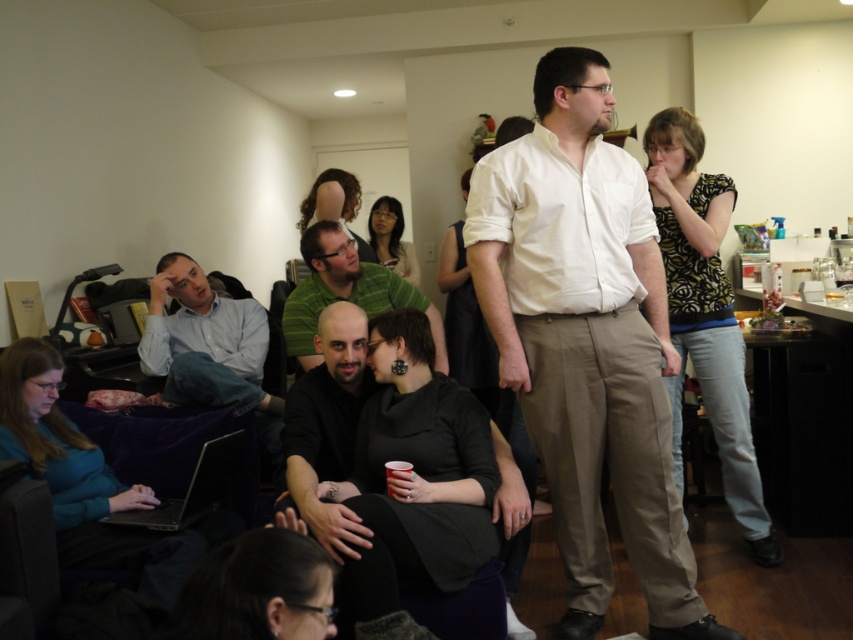
You are standing in the living room and want to place a new decorative item between the black glossy laptop at lower left and the white paper cup at lower center. Where should you position it to ensure it sits above the laptop but below the cup?

You should position the decorative item between the black glossy laptop at lower left and the white paper cup at lower center so that it is above the laptop but below the cup, as the laptop is already positioned below the cup.

You are standing in the living room and notice two shirts hanging on a rack. The matte blue shirt at left and the green matte shirt at center. Which shirt is positioned lower on the rack?

The matte blue shirt at left is below the green matte shirt at center, so it is positioned lower on the rack.

You are organizing a charity event and need to determine which of the two shirts, the matte blue shirt at left or the green matte shirt at center, would be more suitable for a large group photo where visibility is key. Based on their sizes, which one should you choose?

The matte blue shirt at left is larger in size than the green matte shirt at center, so it would be more suitable for the group photo as its larger size ensures better visibility.